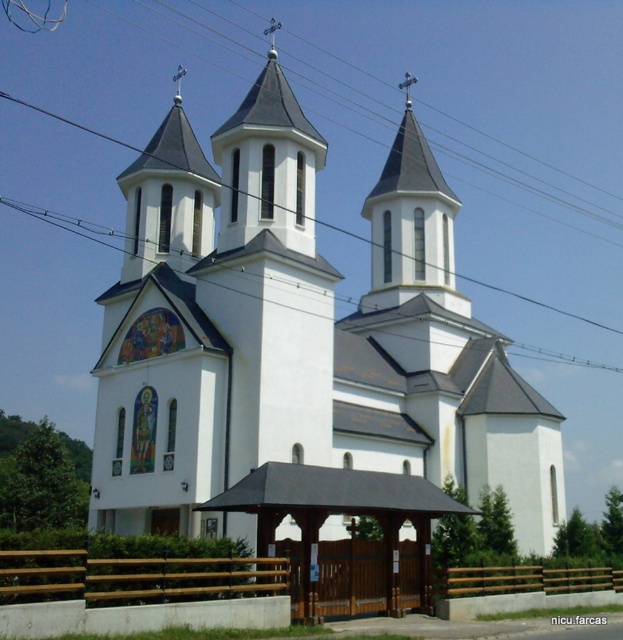
Does white smooth church at center have a greater height compared to brown wooden gate at lower center?

Correct, white smooth church at center is much taller as brown wooden gate at lower center.

Is point (126, 378) positioned after point (115, 572)?

Yes, it is.

Which is behind, point (169, 138) or point (234, 586)?

Positioned behind is point (169, 138).

Locate an element on the screen. The height and width of the screenshot is (640, 623). white smooth church at center is located at coordinates (297, 336).

Is white smooth church at center thinner than brown wooden gazebo at lower center?

No.

Is point (277, 176) farther from camera compared to point (366, 580)?

Yes, it is behind point (366, 580).

Where is `white smooth church at center`? This screenshot has height=640, width=623. white smooth church at center is located at coordinates (297, 336).

Does brown wooden gazebo at lower center appear on the right side of brown wooden gate at lower center?

In fact, brown wooden gazebo at lower center is to the left of brown wooden gate at lower center.

Who is more forward, (320, 577) or (34, 589)?

Point (34, 589) is more forward.

Between point (369, 584) and point (55, 584), which one is positioned in front?

Positioned in front is point (55, 584).

Where is `brown wooden gazebo at lower center`? This screenshot has height=640, width=623. brown wooden gazebo at lower center is located at coordinates (345, 538).